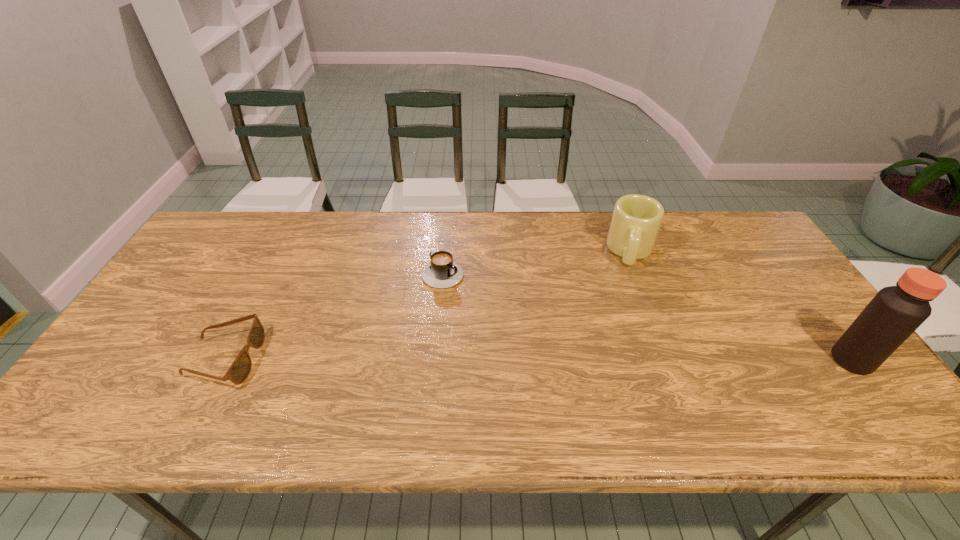
Where is `vacant area located with the handle on the side of the second tallest object`? This screenshot has width=960, height=540. vacant area located with the handle on the side of the second tallest object is located at coordinates (628, 322).

Find the location of a particular element. The image size is (960, 540). free region located 0.080m with the handle on the side of the second object from left to right is located at coordinates (479, 295).

Where is `free region located 0.080m with the handle on the side of the second object from left to right`? The image size is (960, 540). free region located 0.080m with the handle on the side of the second object from left to right is located at coordinates pyautogui.click(x=479, y=295).

Find the location of a particular element. The image size is (960, 540). free space located with the handle on the side of the second object from left to right is located at coordinates (544, 333).

Find the location of `mug at the far edge`. mug at the far edge is located at coordinates (636, 220).

Find the location of a particular element. The image size is (960, 540). cappuccino present at the far edge is located at coordinates (442, 272).

The width and height of the screenshot is (960, 540). Find the location of `sunglasses present at the near edge`. sunglasses present at the near edge is located at coordinates (238, 372).

I want to click on vinegar situated at the near edge, so click(x=895, y=312).

The image size is (960, 540). I want to click on object that is at the right edge, so click(x=895, y=312).

You are a GUI agent. You are given a task and a screenshot of the screen. Output one action in this format:
    pyautogui.click(x=<x>, y=<y>)
    Task: Click on the object present at the near right corner
    The image size is (960, 540).
    Given the screenshot: What is the action you would take?
    pyautogui.click(x=895, y=312)